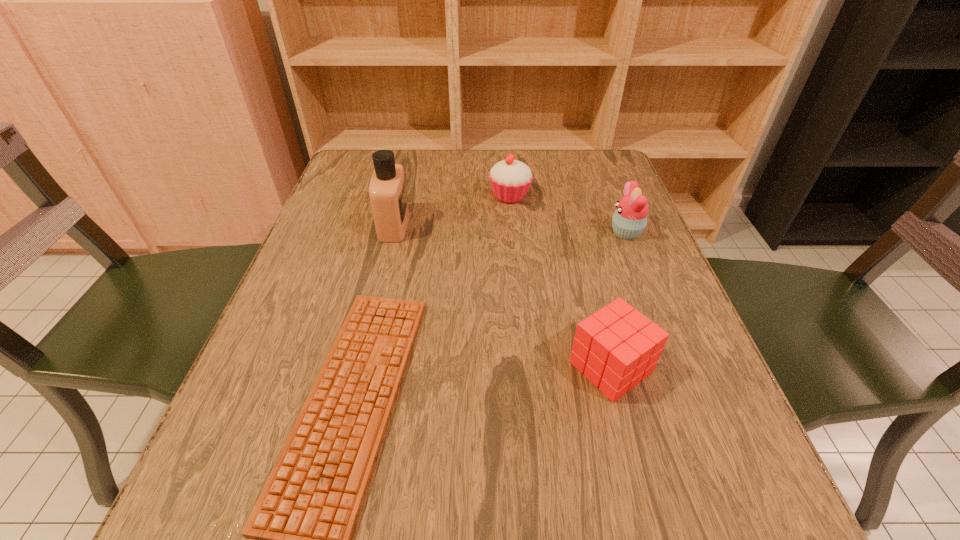
Where is `perfume`? The height and width of the screenshot is (540, 960). perfume is located at coordinates (387, 190).

What are the coordinates of `the nearer cupcake` in the screenshot? It's located at tap(630, 218).

You are a GUI agent. You are given a task and a screenshot of the screen. Output one action in this format:
    pyautogui.click(x=<x>, y=<y>)
    Task: Click on the right cupcake
    The image size is (960, 540).
    Given the screenshot: What is the action you would take?
    pyautogui.click(x=630, y=218)

The image size is (960, 540). In order to click on the farthest object in this screenshot , I will do `click(510, 179)`.

I want to click on the left cupcake, so click(x=510, y=179).

This screenshot has width=960, height=540. What are the coordinates of `cube` in the screenshot? It's located at (616, 347).

Find the location of a particular element. the second object from right to left is located at coordinates (616, 347).

The width and height of the screenshot is (960, 540). In order to click on vacant space located on the front label of the tallest object in this screenshot , I will do `click(447, 225)`.

Identify the location of free space located 0.150m on the face of the right cupcake. (542, 232).

Image resolution: width=960 pixels, height=540 pixels. I want to click on blank space located on the face of the right cupcake, so click(569, 232).